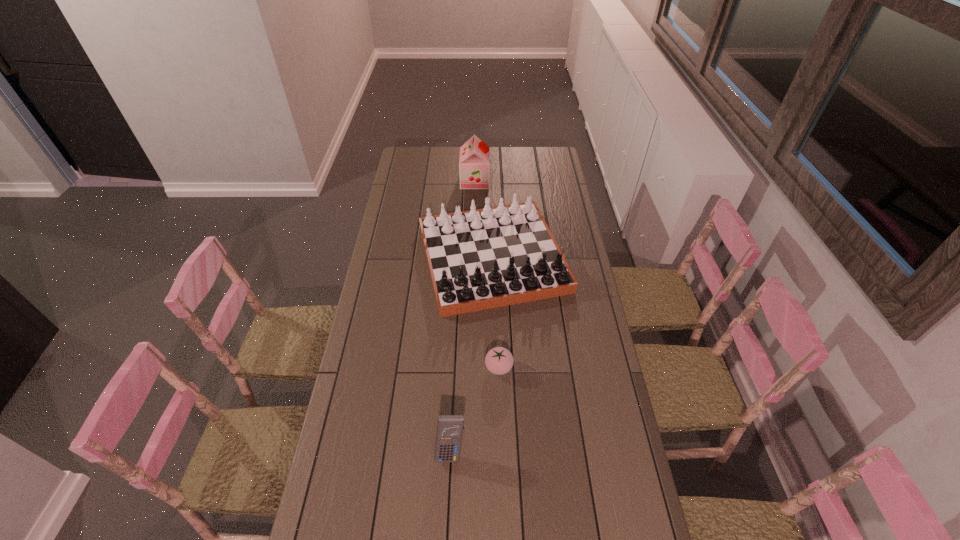
In order to click on object that is at the left edge in this screenshot , I will do `click(480, 259)`.

Identify the location of object that is at the right edge. The width and height of the screenshot is (960, 540). (480, 259).

Where is `vacant point at the far edge`? vacant point at the far edge is located at coordinates (460, 154).

In the image, there is a desktop. Where is `vacant space at the left edge`? vacant space at the left edge is located at coordinates (407, 312).

You are a GUI agent. You are given a task and a screenshot of the screen. Output one action in this format:
    pyautogui.click(x=<x>, y=<y>)
    Task: Click on the blank space at the right edge of the desktop
    The height and width of the screenshot is (540, 960).
    Given the screenshot: What is the action you would take?
    pyautogui.click(x=600, y=333)

Locate an element on the screen. This screenshot has width=960, height=540. vacant space at the far left corner of the desktop is located at coordinates (409, 149).

Where is `free region at the far right corner`? free region at the far right corner is located at coordinates (546, 164).

In order to click on free point between the nearest object and the gameboard in this screenshot , I will do `click(471, 354)`.

Find the location of a particular element. This screenshot has width=960, height=540. free space between the shortest object and the gameboard is located at coordinates (495, 313).

You are a GUI agent. You are given a task and a screenshot of the screen. Output one action in this format:
    pyautogui.click(x=<x>, y=<y>)
    Task: Click on the free area in between the nearest object and the gameboard
    The image size is (960, 540).
    Given the screenshot: What is the action you would take?
    pyautogui.click(x=471, y=354)